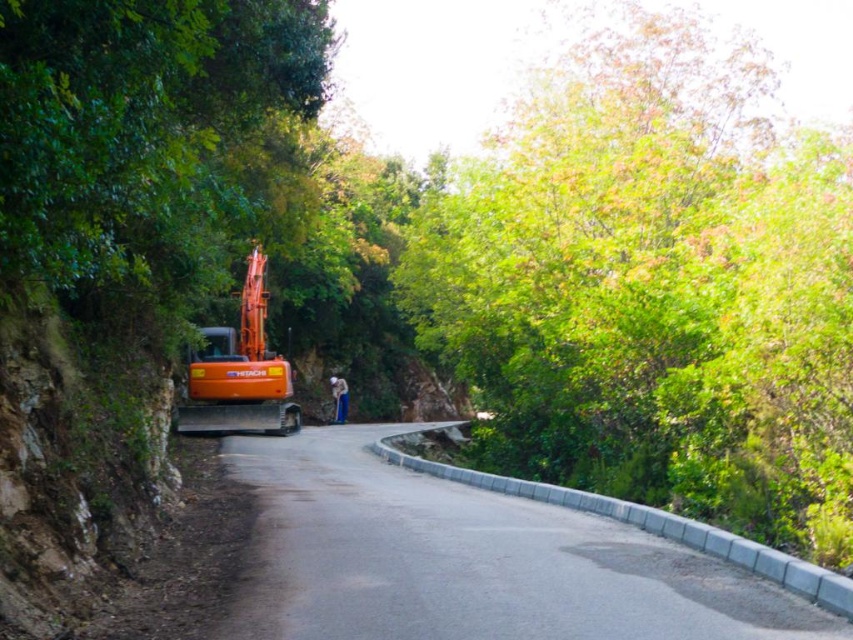
Question: Can you confirm if green leafy tree at upper center is thinner than orange metallic excavator at left?

Choices:
 (A) no
 (B) yes

Answer: (A)

Question: Which point is farther to the camera?

Choices:
 (A) orange metallic excavator at left
 (B) asphalt road at center

Answer: (A)

Question: Which object appears farthest from the camera in this image?

Choices:
 (A) green leafy tree at upper center
 (B) asphalt road at center

Answer: (A)

Question: Which point is farther to the camera?

Choices:
 (A) (550, 513)
 (B) (431, 346)

Answer: (B)

Question: Does green leafy tree at upper center appear on the left side of orange metallic excavator at left?

Choices:
 (A) no
 (B) yes

Answer: (A)

Question: Is green leafy tree at upper center closer to the viewer compared to orange metallic excavator at left?

Choices:
 (A) no
 (B) yes

Answer: (B)